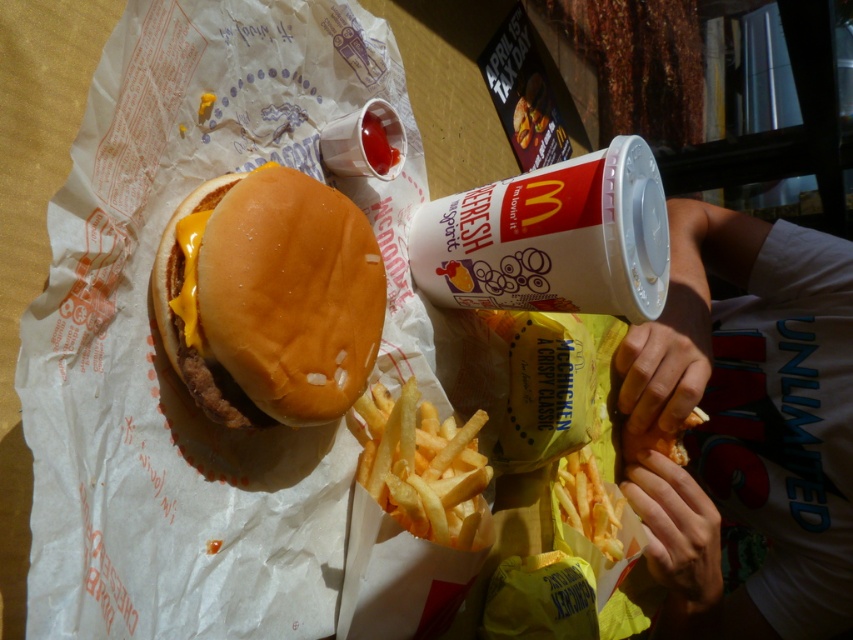
You are a customer looking at the McDonalds meal on the table. There are two points marked on the table surface. The first point is at coordinate point (666, 470) and the second is at point (572, 467). Which point is closer to you?

Point (666, 470) is closer to you than point (572, 467) because it is further to the viewer.

You are a food delivery person who just arrived at a customer location. You see the white cotton shirt at upper right hanging on a hook near the door. The shirt is 3.45 feet away from you. Can you reach it to hand over the McDonalds meal?

The white cotton shirt at upper right is 3.45 feet away from the viewer, so yes, the delivery person can reach it to hand over the McDonalds meal since the distance is within a typical reaching range.